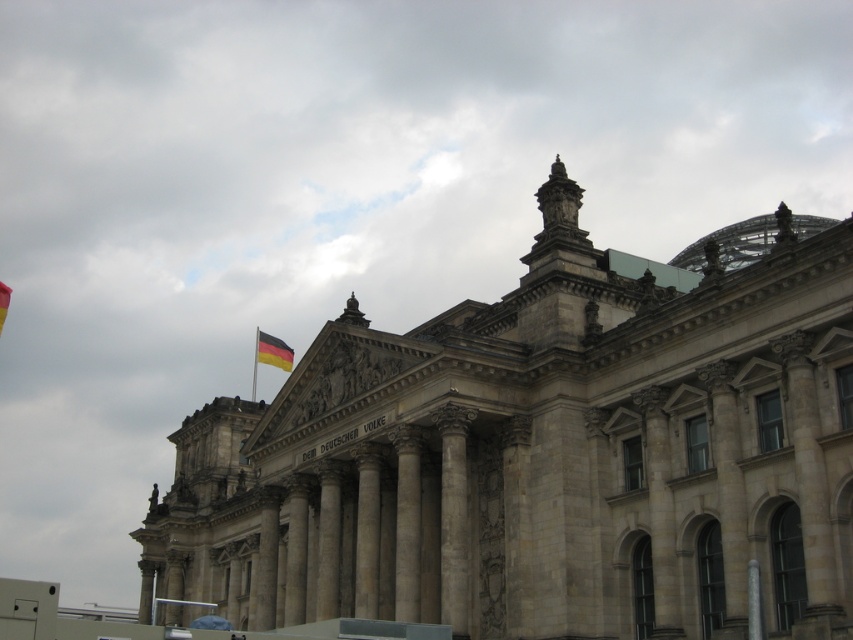
Question: Which point is farther to the camera?

Choices:
 (A) (288, 368)
 (B) (1, 305)
 (C) (257, 332)

Answer: (C)

Question: Which is farther from the metallic flag pole at upper center?

Choices:
 (A) german flag at center
 (B) red fabric flag at left

Answer: (B)

Question: Is german flag at center bigger than metallic flag pole at upper center?

Choices:
 (A) no
 (B) yes

Answer: (A)

Question: Can you confirm if red fabric flag at left is bigger than metallic flag pole at upper center?

Choices:
 (A) no
 (B) yes

Answer: (A)

Question: Does red fabric flag at left appear over metallic flag pole at upper center?

Choices:
 (A) yes
 (B) no

Answer: (A)

Question: Which object appears farthest from the camera in this image?

Choices:
 (A) german flag at center
 (B) metallic flag pole at upper center

Answer: (B)